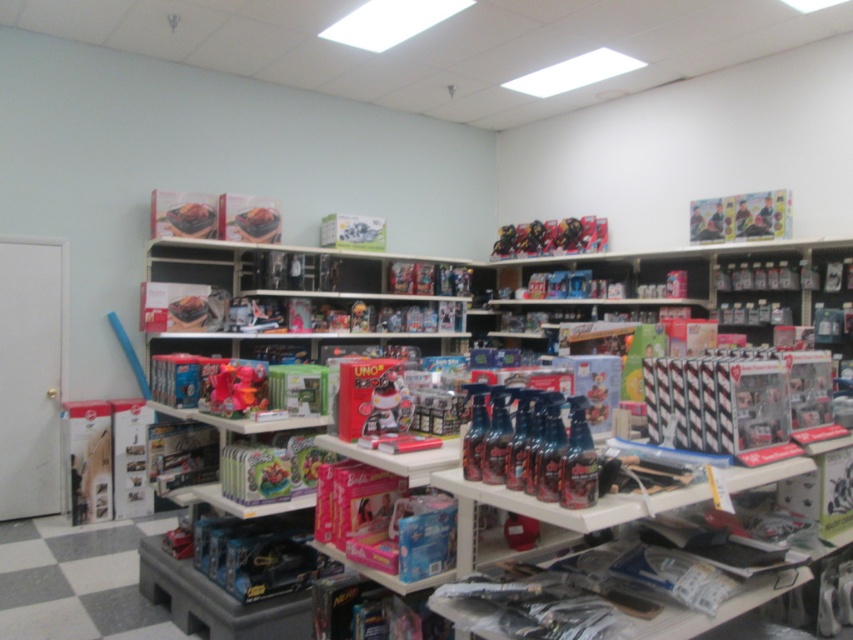
Measure the distance from glossy plastic spray bottles at center to matte plastic robot at center.

64.58 centimeters

Who is shorter, glossy plastic spray bottles at center or matte plastic robot at center?

Standing shorter between the two is matte plastic robot at center.

Is point (556, 420) positioned behind point (392, 420)?

No, it is not.

Where is `glossy plastic spray bottles at center`? Image resolution: width=853 pixels, height=640 pixels. glossy plastic spray bottles at center is located at coordinates (543, 449).

Can you confirm if mattel action figures at upper center is thinner than matte pink plush at center?

Incorrect, mattel action figures at upper center's width is not less than matte pink plush at center's.

At what (x,y) coordinates should I click in order to perform the action: click on mattel action figures at upper center. Please return your answer as a coordinate pair (x, y). Looking at the image, I should click on (550, 237).

In the scene shown: Who is positioned more to the right, mattel action figures at upper center or matte plastic robot at center?

mattel action figures at upper center

You are a GUI agent. You are given a task and a screenshot of the screen. Output one action in this format:
    pyautogui.click(x=<x>, y=<y>)
    Task: Click on the mattel action figures at upper center
    This screenshot has height=640, width=853.
    Given the screenshot: What is the action you would take?
    pyautogui.click(x=550, y=237)

Where is `mattel action figures at upper center`? The image size is (853, 640). mattel action figures at upper center is located at coordinates (550, 237).